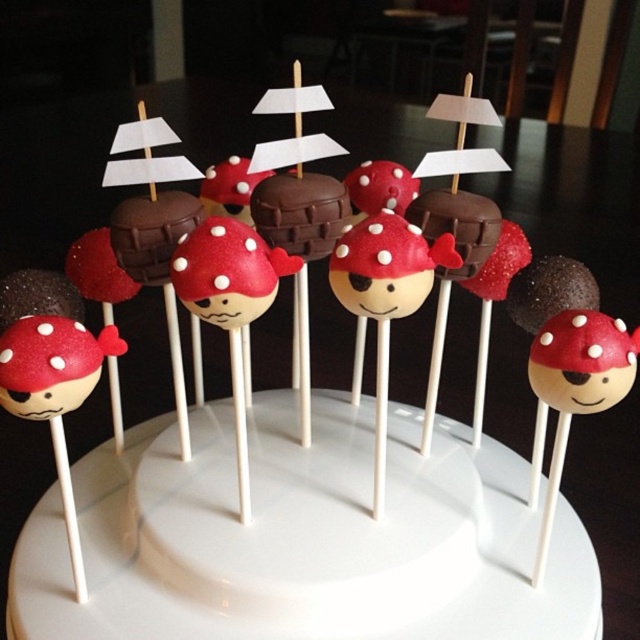
You are a customer at a bakery and want to take a photo of the cake pops. You notice two points on the stand where you can place your phone to take a picture. The first point is at coordinate point (294, 244) and the second is at coordinate point (141, 234). Which point should you choose to ensure your phone is closer to the cake pops?

Point (141, 234) is closer to the cake pops than point (294, 244), so you should choose point (141, 234) to place your phone for a closer shot.

Based on the photo, you are a baker who needs to place a 3D printed cake pop stand that is 10 cm wide. You see the matte chocolate cake pop at center and the chocolate matte cake pop at center. Which cake pop should you place the stand next to to ensure it fits without overlapping?

The chocolate matte cake pop at center has a smaller width than the matte chocolate cake pop at center. Therefore, placing the 10 cm wide stand next to the chocolate matte cake pop at center would provide more space and prevent overlapping.

You are a cake decorator who needs to place a new cake pop exactly at the center of the stand. You currently have a matte chocolate cake pop at center. Where should you place the new cake pop relative to the existing one?

The matte chocolate cake pop at center is already positioned at the center coordinates of the stand, so the new cake pop should be placed in the same location to maintain central alignment.